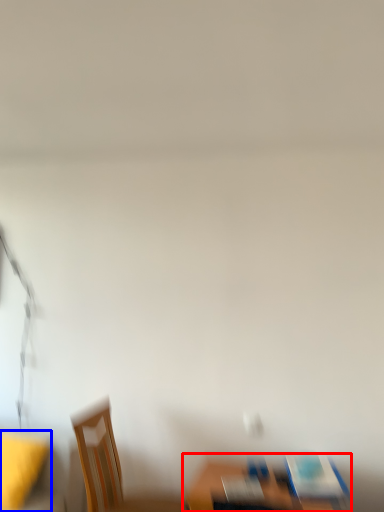
Question: Which object is further to the camera taking this photo, furniture (highlighted by a red box) or table (highlighted by a blue box)?

Choices:
 (A) furniture
 (B) table

Answer: (B)